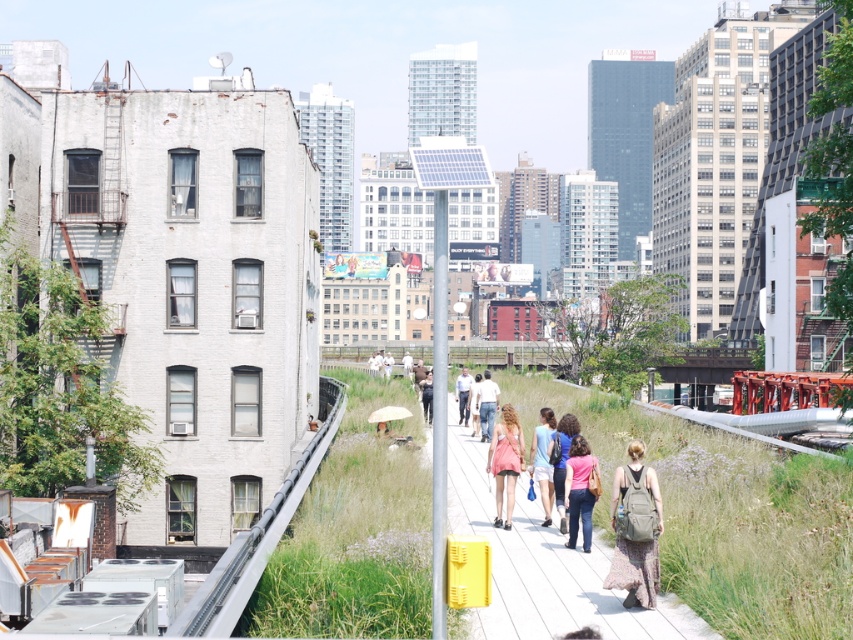
You are standing at the point with coordinates point (471,416) and want to walk towards the point with coordinates point (532,477). Based on the scene description, will you be moving towards the building or away from it?

Based on the scene description, the point (532,477) is in front of point (471,416). Since the white brick building is in the foreground, moving towards the point in front would mean moving away from the building towards the walkway and green space.

You are standing at the edge of the walkway and want to step onto the white wooden pavement at center. Based on its position, can you estimate whether it is directly in front of you or to your side?

The white wooden pavement at center is located at point coordinates, so it is directly in front of you.

You are a photographer standing on the walkway and want to capture both the pink fabric dress at center and the matte blue shirt at center in the same frame. Which clothing item is closer to you, and why?

The pink fabric dress at center is closer to you because it is positioned over the matte blue shirt at center, meaning it is in front of the other object.